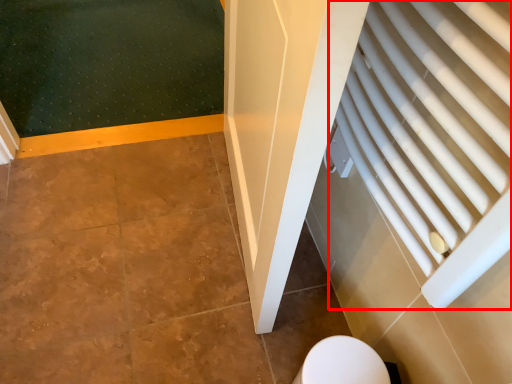
Question: From the image's perspective, where is curtain (annotated by the red box) located relative to toilet?

Choices:
 (A) above
 (B) below

Answer: (A)